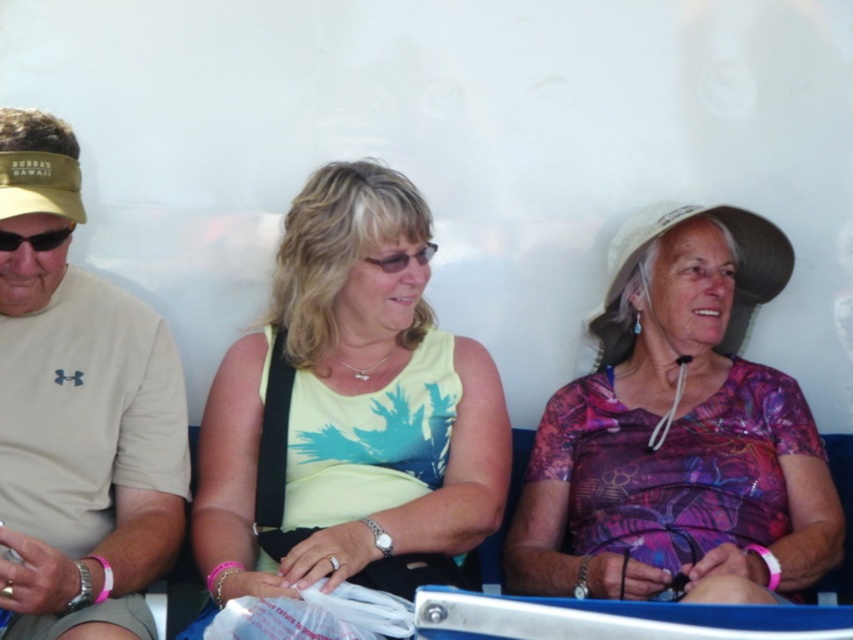
Question: Which object is positioned closest to the matte black glasses at center?

Choices:
 (A) tan fabric shirt at left
 (B) black plastic sunglasses at left
 (C) purple printed dress at center

Answer: (B)

Question: Is yellow fabric tank top at center bigger than black plastic sunglasses at left?

Choices:
 (A) yes
 (B) no

Answer: (A)

Question: Which is nearer to the matte black glasses at center?

Choices:
 (A) tan fabric shirt at left
 (B) yellow fabric tank top at center

Answer: (B)

Question: Can you confirm if purple printed dress at center is smaller than tan fabric shirt at left?

Choices:
 (A) yes
 (B) no

Answer: (B)

Question: Which point is farther from the camera taking this photo?

Choices:
 (A) (25, 241)
 (B) (100, 449)

Answer: (B)

Question: Is tan fabric shirt at left above black plastic sunglasses at left?

Choices:
 (A) no
 (B) yes

Answer: (A)